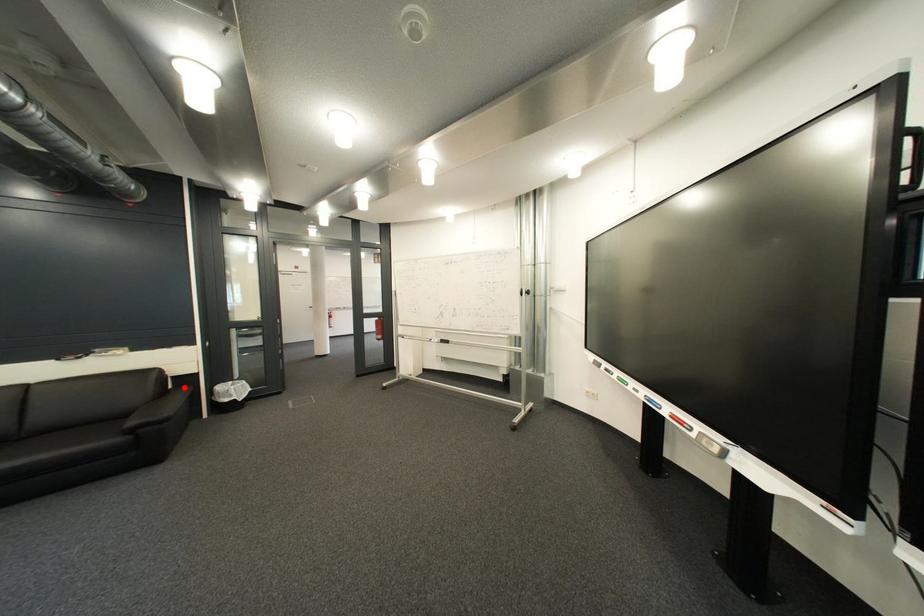
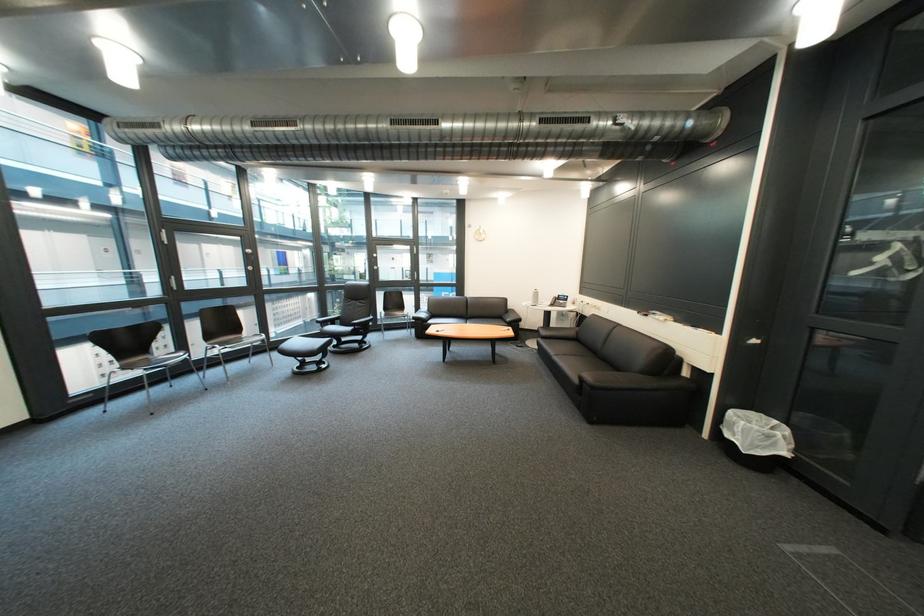
Find the pixel in the second image that matches the highlighted location in the first image.

(699, 375)